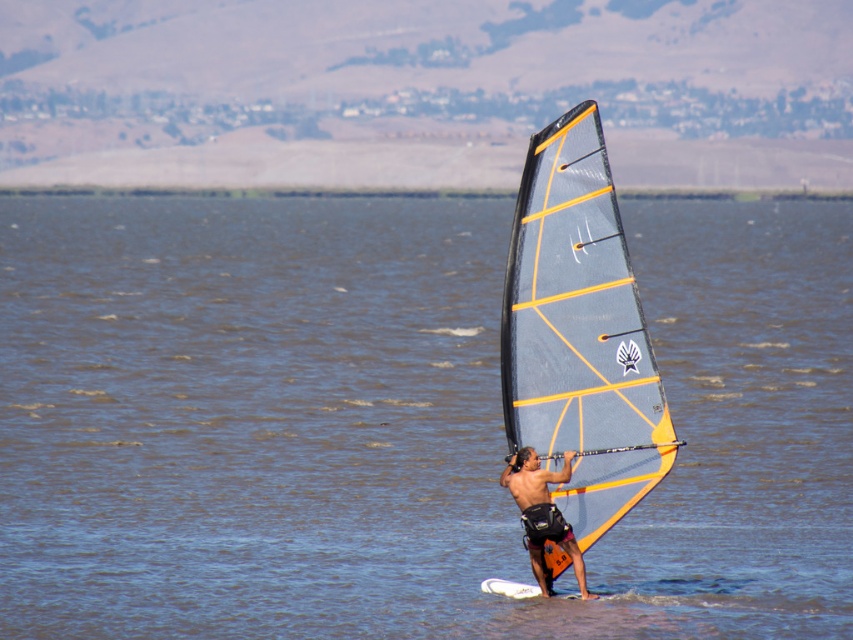
Describe the element at coordinates (579, 332) in the screenshot. This screenshot has height=640, width=853. I see `gray/yellow composite sail at center` at that location.

Measure the distance between gray/yellow composite sail at center and camera.

They are 72.65 feet apart.

You are a GUI agent. You are given a task and a screenshot of the screen. Output one action in this format:
    pyautogui.click(x=<x>, y=<y>)
    Task: Click on the gray/yellow composite sail at center
    This screenshot has height=640, width=853.
    Given the screenshot: What is the action you would take?
    pyautogui.click(x=579, y=332)

Is point (746, 433) behind point (532, 381)?

Yes, point (746, 433) is behind point (532, 381).

Does clear blue water at center appear over gray/yellow composite sail at center?

Indeed, clear blue water at center is positioned over gray/yellow composite sail at center.

Does point (788, 586) come farther from viewer compared to point (590, 444)?

Yes, it is.

Identify the location of clear blue water at center. This screenshot has width=853, height=640. (399, 422).

Does clear blue water at center appear over matte black wetsuit at center?

Correct, clear blue water at center is located above matte black wetsuit at center.

Between clear blue water at center and matte black wetsuit at center, which one has more height?

With more height is clear blue water at center.

Does point (7, 440) lie behind point (548, 499)?

That is True.

Image resolution: width=853 pixels, height=640 pixels. In order to click on clear blue water at center in this screenshot , I will do `click(399, 422)`.